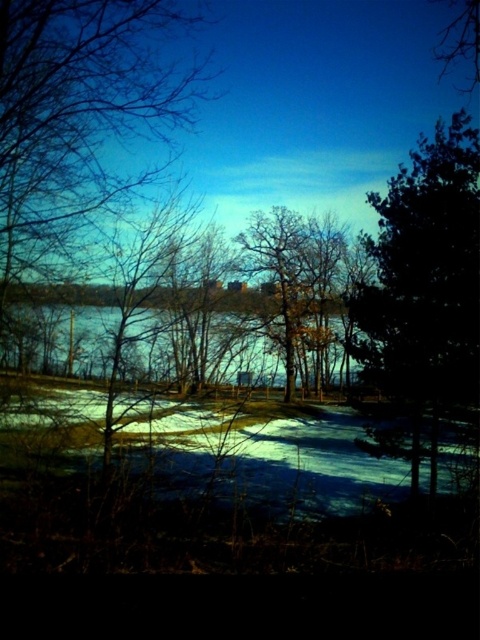
Is green leafy tree at right shorter than blue water at center?

Incorrect, green leafy tree at right's height does not fall short of blue water at center's.

Is green leafy tree at right wider than blue water at center?

Indeed, green leafy tree at right has a greater width compared to blue water at center.

The image size is (480, 640). Describe the element at coordinates (424, 282) in the screenshot. I see `green leafy tree at right` at that location.

At what (x,y) coordinates should I click in order to perform the action: click on green leafy tree at right. Please return your answer as a coordinate pair (x, y). This screenshot has height=640, width=480. Looking at the image, I should click on (424, 282).

Can you confirm if frozen water at center is positioned to the right of blue water at center?

Correct, you'll find frozen water at center to the right of blue water at center.

Is point (277, 472) closer to camera compared to point (182, 316)?

Yes, point (277, 472) is in front of point (182, 316).

The width and height of the screenshot is (480, 640). In order to click on frozen water at center in this screenshot , I will do `click(265, 460)`.

Between point (453, 132) and point (346, 410), which one is positioned behind?

Point (346, 410)

Which is more to the right, green leafy tree at right or frozen water at center?

From the viewer's perspective, green leafy tree at right appears more on the right side.

Find the location of a particular element. Image resolution: width=480 pixels, height=640 pixels. green leafy tree at right is located at coordinates (424, 282).